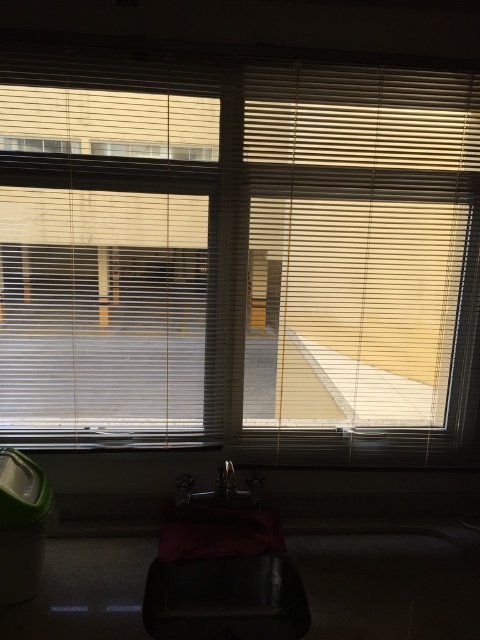
Between point (121, 253) and point (11, 140), which one is positioned in front?

Point (11, 140) is more forward.

How distant is matte white blinds at left from transparent plastic window at upper left?

They are 12.67 inches apart.

Does point (91, 80) lie in front of point (71, 148)?

Yes, point (91, 80) is closer to viewer.

Where is `matte white blinds at left`? The image size is (480, 640). matte white blinds at left is located at coordinates (104, 248).

Does metallic sink at center have a greater height compared to transparent plastic window at upper left?

Yes.

Between point (240, 572) and point (80, 145), which one is positioned in front?

Positioned in front is point (80, 145).

Where is `metallic sink at center`? metallic sink at center is located at coordinates (223, 566).

Is matte plastic blinds at center further to camera compared to transparent plastic window at upper left?

No, matte plastic blinds at center is in front of transparent plastic window at upper left.

Can you confirm if matte plastic blinds at center is positioned to the left of transparent plastic window at upper left?

In fact, matte plastic blinds at center is to the right of transparent plastic window at upper left.

Describe the element at coordinates (240, 257) in the screenshot. This screenshot has height=640, width=480. I see `matte plastic blinds at center` at that location.

This screenshot has height=640, width=480. What are the coordinates of `matte plastic blinds at center` in the screenshot? It's located at (240, 257).